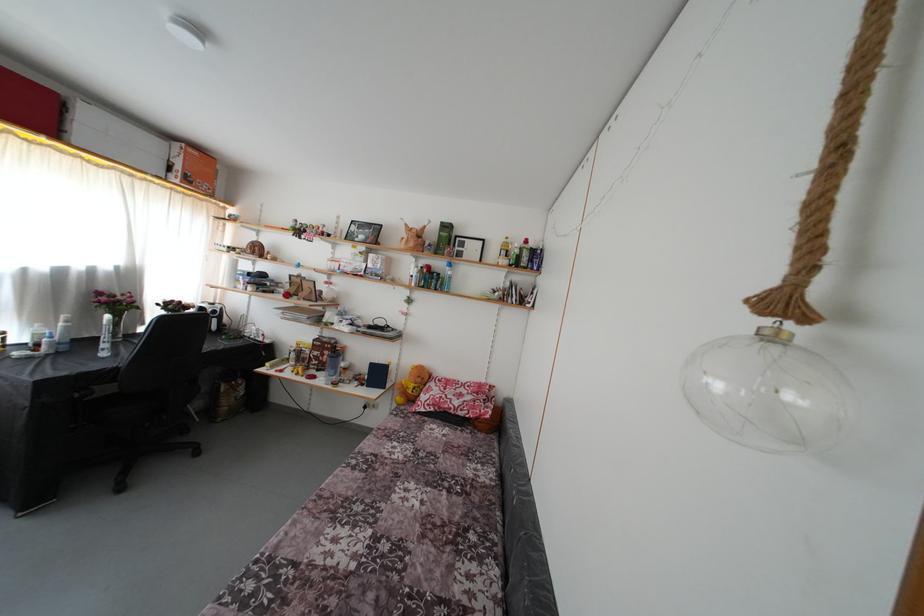
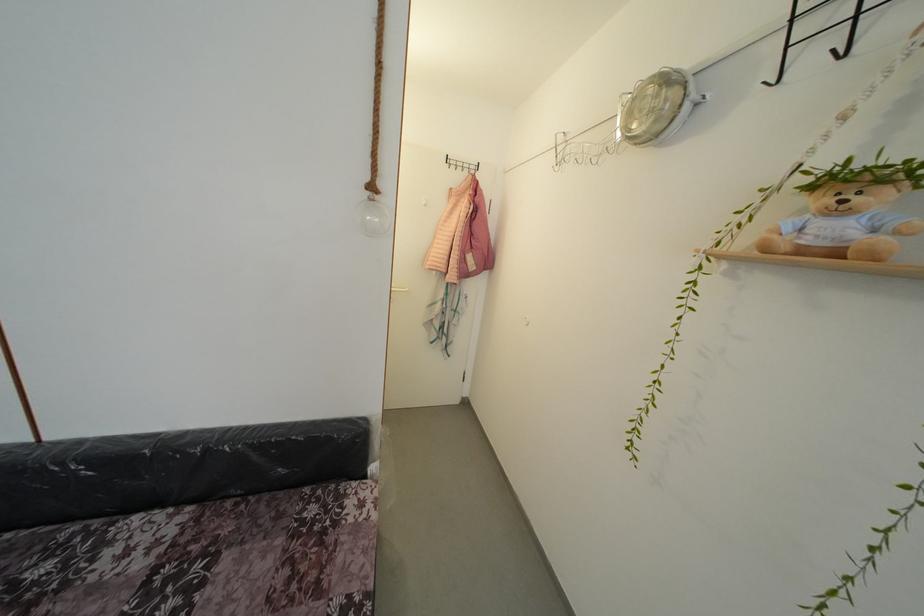
Find the pixel in the second image that matches [463,570] in the first image.

(99, 585)